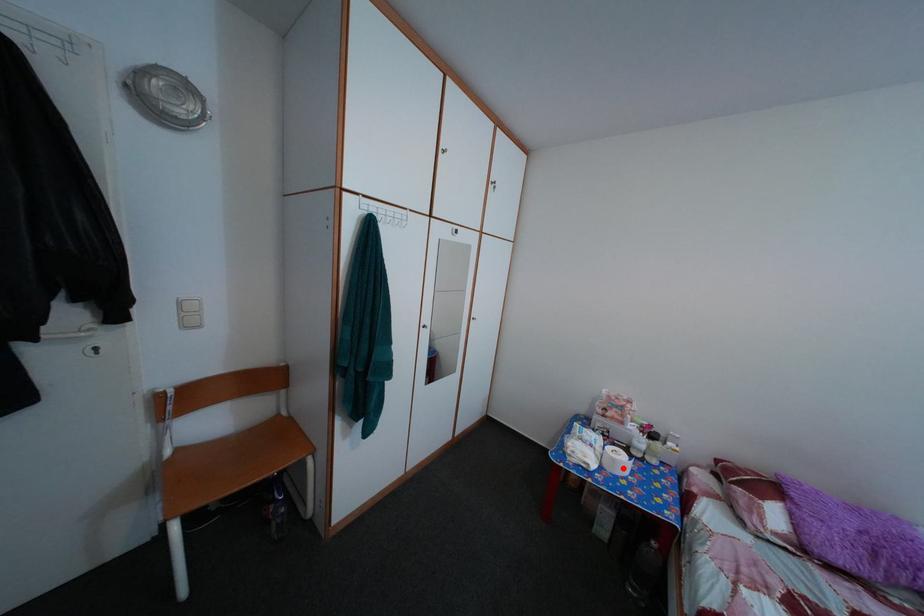
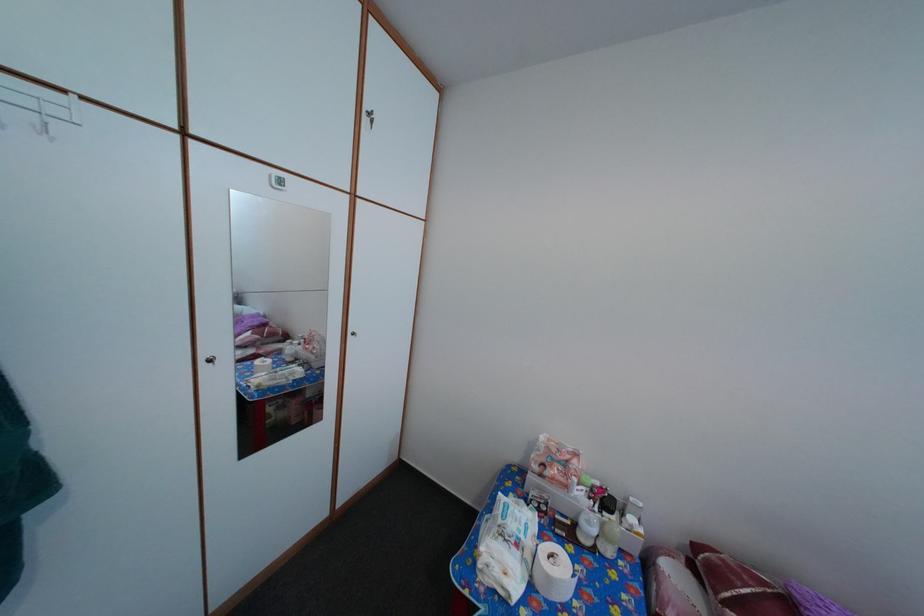
In the second image, find the point that corresponds to the highlighted location in the first image.

(558, 586)